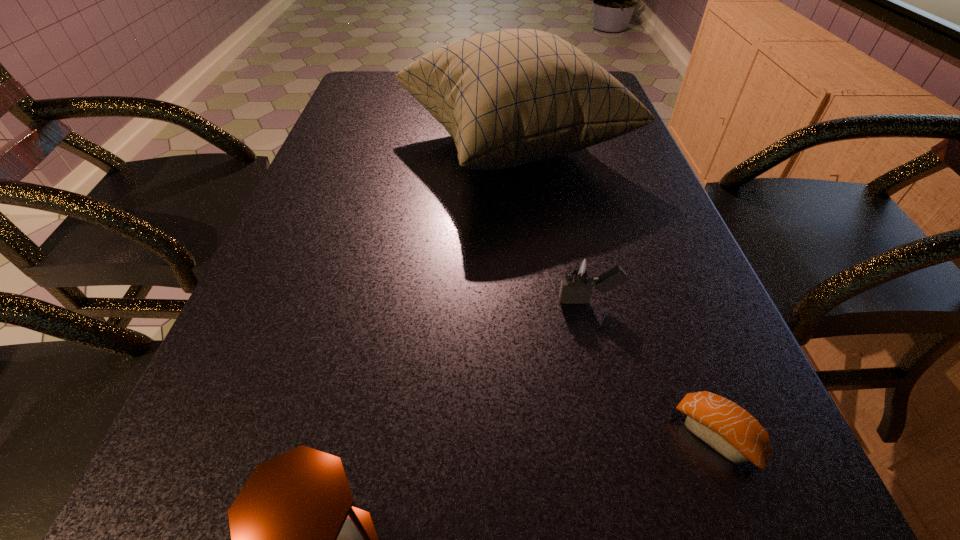
The width and height of the screenshot is (960, 540). Identify the location of cushion that is positioned at the right edge. (509, 97).

I want to click on igniter positioned at the right edge, so click(x=579, y=278).

What are the coordinates of `sushi present at the right edge` in the screenshot? It's located at (726, 427).

This screenshot has width=960, height=540. What are the coordinates of `object at the far right corner` in the screenshot? It's located at (509, 97).

The width and height of the screenshot is (960, 540). Find the location of `free space at the near edge of the desktop`. free space at the near edge of the desktop is located at coordinates (444, 539).

Where is `vacant region at the left edge`? vacant region at the left edge is located at coordinates (248, 459).

Identify the location of free spot at the right edge of the desktop. This screenshot has width=960, height=540. click(655, 248).

In the image, there is a desktop. Where is `free region at the far left corner`? This screenshot has height=540, width=960. free region at the far left corner is located at coordinates (356, 87).

Find the location of `vacant point located between the shortest object and the cushion`. vacant point located between the shortest object and the cushion is located at coordinates (614, 291).

The image size is (960, 540). Find the location of `empty space between the shortest object and the tallest object`. empty space between the shortest object and the tallest object is located at coordinates (614, 291).